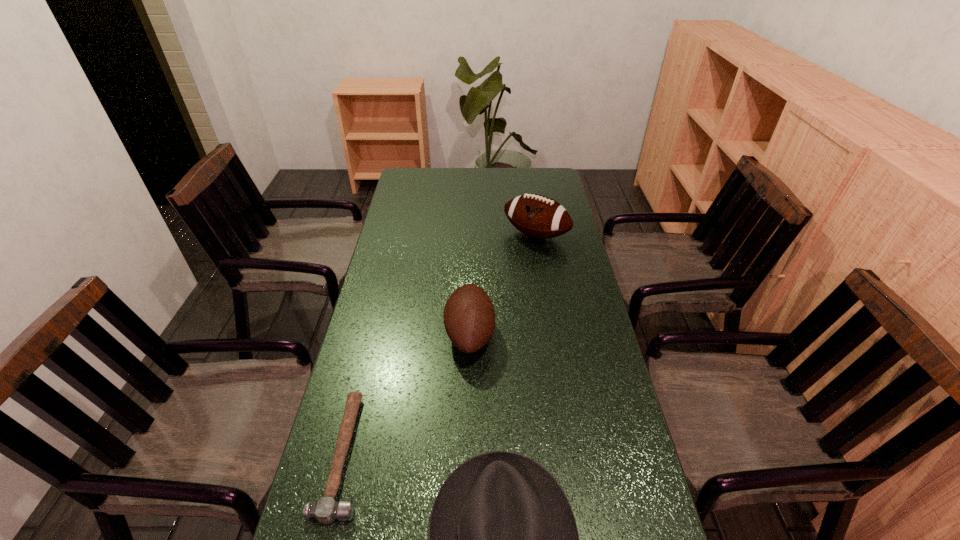
Locate an element on the screen. This screenshot has height=540, width=960. vacant area that lies between the farthest object and the leftmost object is located at coordinates [x=440, y=345].

Choose which object is the nearest neighbor to the hammer. Please provide its 2D coordinates. Your answer should be formatted as a tuple, i.e. [(x, y)], where the tuple contains the x and y coordinates of a point satisfying the conditions above.

[(503, 539)]

Choose which object is the third nearest neighbor to the farther football. Please provide its 2D coordinates. Your answer should be formatted as a tuple, i.e. [(x, y)], where the tuple contains the x and y coordinates of a point satisfying the conditions above.

[(503, 539)]

The image size is (960, 540). What are the coordinates of `free spot that satisfies the following two spatial constraints: 1. on the front side of the right football; 2. on the laces of the nearer football` in the screenshot? It's located at (552, 334).

Identify the location of blank area in the image that satisfies the following two spatial constraints: 1. on the front side of the farthest object; 2. on the striking face of the leftmost object. (572, 455).